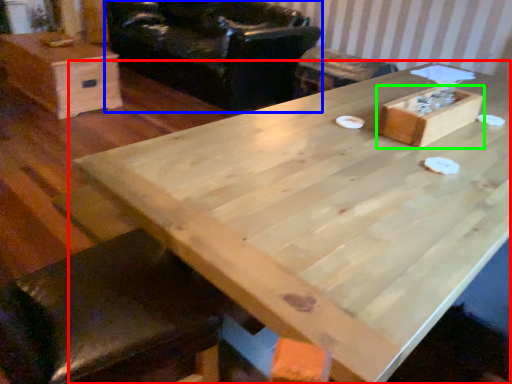
Question: Which is farther away from table (highlighted by a red box)? armchair (highlighted by a blue box) or storage box (highlighted by a green box)?

Choices:
 (A) armchair
 (B) storage box

Answer: (A)